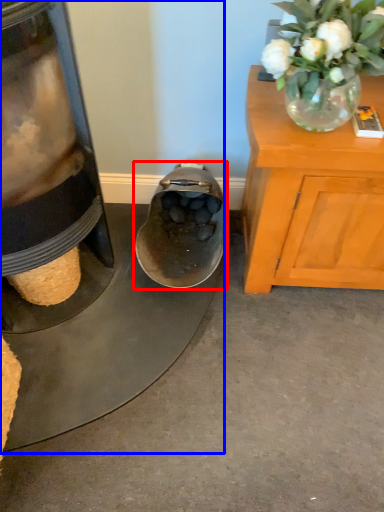
Question: Which point is further to the camera, footwear (highlighted by a red box) or appliance (highlighted by a blue box)?

Choices:
 (A) footwear
 (B) appliance

Answer: (A)